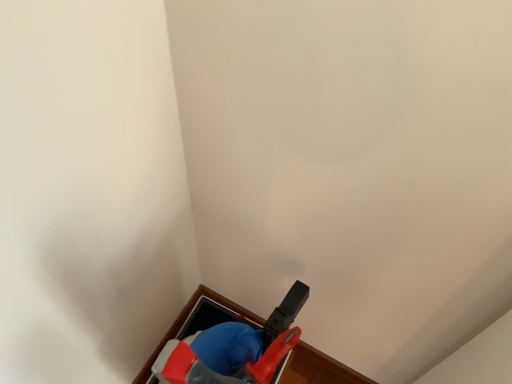
What is the approximate height of blue rubber glove at lower center?

The height of blue rubber glove at lower center is 2.23 inches.

Identify the location of blue rubber glove at lower center. (204, 322).

Describe the element at coordinates (204, 322) in the screenshot. I see `blue rubber glove at lower center` at that location.

Locate an element on the screen. This screenshot has height=384, width=512. blue rubber glove at lower center is located at coordinates (204, 322).